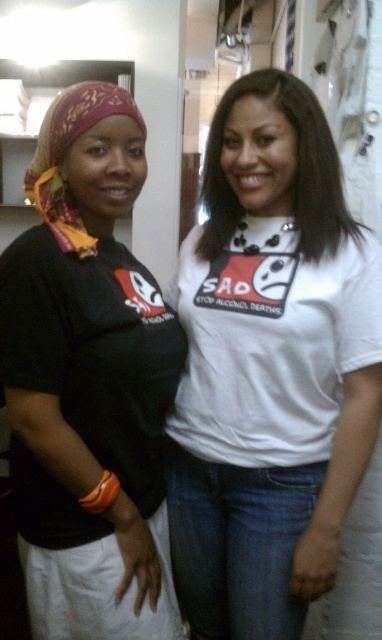
Is point (294, 225) less distant than point (134, 429)?

That is False.

Between white matte t-shirt at center and matte black shirt at left, which one appears on the right side from the viewer's perspective?

Positioned to the right is white matte t-shirt at center.

Locate an element on the screen. The image size is (382, 640). white matte t-shirt at center is located at coordinates (270, 368).

Is matte black shirt at left further to camera compared to printed silk headscarf at left?

No, it is not.

From the picture: Can you confirm if matte black shirt at left is positioned below printed silk headscarf at left?

Yes, matte black shirt at left is below printed silk headscarf at left.

Which is behind, point (92, 118) or point (56, 104)?

The point (56, 104) is behind.

Locate an element on the screen. This screenshot has width=382, height=640. matte black shirt at left is located at coordinates (89, 381).

Is white matte t-shirt at center thinner than printed silk headscarf at left?

In fact, white matte t-shirt at center might be wider than printed silk headscarf at left.

Between point (171, 525) and point (103, 92), which one is positioned in front?

Point (103, 92)

Where is `white matte t-shirt at center`? The width and height of the screenshot is (382, 640). white matte t-shirt at center is located at coordinates (270, 368).